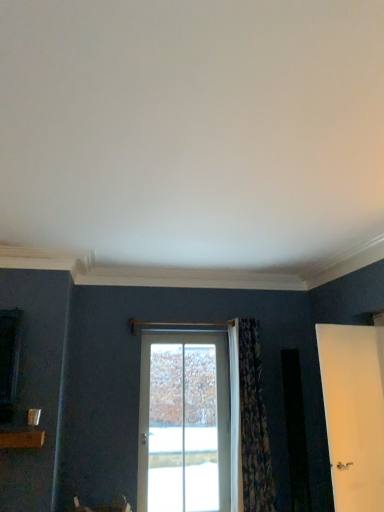
Question: From a real-world perspective, does white matte door at right, the 1th door from the right, stand above patterned fabric curtain at center?

Choices:
 (A) yes
 (B) no

Answer: (A)

Question: Is white matte door at right, arranged as the 2th door when viewed from the back, to the right of patterned fabric curtain at center from the viewer's perspective?

Choices:
 (A) no
 (B) yes

Answer: (B)

Question: Considering the relative sizes of white matte door at right, which is the second door from left to right, and patterned fabric curtain at center in the image provided, is white matte door at right, which is the second door from left to right, smaller than patterned fabric curtain at center?

Choices:
 (A) yes
 (B) no

Answer: (A)

Question: Considering the relative positions of white matte door at right, the 1th door from the right, and patterned fabric curtain at center in the image provided, is white matte door at right, the 1th door from the right, behind patterned fabric curtain at center?

Choices:
 (A) yes
 (B) no

Answer: (B)

Question: Is the position of white matte door at right, arranged as the 2th door when viewed from the back, less distant than that of patterned fabric curtain at center?

Choices:
 (A) yes
 (B) no

Answer: (A)

Question: In terms of height, does white glass door at center, acting as the first door starting from the left, look taller or shorter compared to patterned fabric curtain at center?

Choices:
 (A) short
 (B) tall

Answer: (A)

Question: Is white glass door at center, the second door positioned from the right, wider or thinner than patterned fabric curtain at center?

Choices:
 (A) wide
 (B) thin

Answer: (B)

Question: Considering the positions of point (165, 435) and point (253, 450), is point (165, 435) closer or farther from the camera than point (253, 450)?

Choices:
 (A) farther
 (B) closer

Answer: (A)

Question: Is white glass door at center, acting as the first door starting from the left, inside or outside of patterned fabric curtain at center?

Choices:
 (A) inside
 (B) outside

Answer: (B)

Question: Do you think white glass door at center, placed as the second door when sorted from front to back, is within white matte door at right, which is the second door from left to right, or outside of it?

Choices:
 (A) inside
 (B) outside

Answer: (B)

Question: From a real-world perspective, is white glass door at center, which is the first door in back-to-front order, above or below white matte door at right, which is the 1th door from front to back?

Choices:
 (A) below
 (B) above

Answer: (A)

Question: Is point (160, 359) positioned closer to the camera than point (345, 329)?

Choices:
 (A) closer
 (B) farther

Answer: (B)

Question: Relative to white matte door at right, which is the second door from left to right, is white glass door at center, which is the first door in back-to-front order, in front or behind?

Choices:
 (A) front
 (B) behind

Answer: (B)

Question: From the image's perspective, relative to patterned fabric curtain at center, is white matte door at right, which is the second door from left to right, above or below?

Choices:
 (A) above
 (B) below

Answer: (A)

Question: Considering the relative positions of white matte door at right, which is the 1th door from front to back, and patterned fabric curtain at center in the image provided, is white matte door at right, which is the 1th door from front to back, to the left or to the right of patterned fabric curtain at center?

Choices:
 (A) left
 (B) right

Answer: (B)